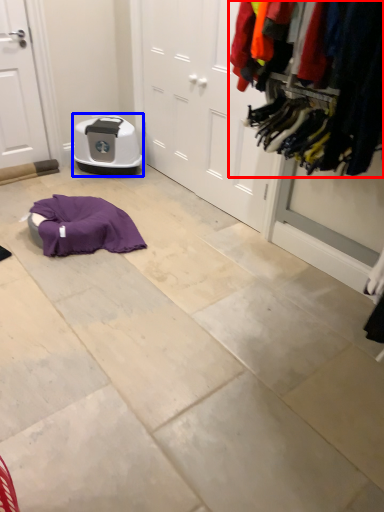
Question: Which of the following is the closest to the observer, closet (highlighted by a red box) or appliance (highlighted by a blue box)?

Choices:
 (A) closet
 (B) appliance

Answer: (A)